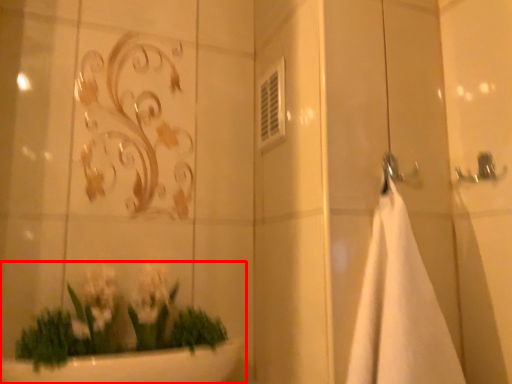
Question: From the image's perspective, what is the correct spatial positioning of houseplant (annotated by the red box) in reference to bath towel?

Choices:
 (A) below
 (B) above

Answer: (A)